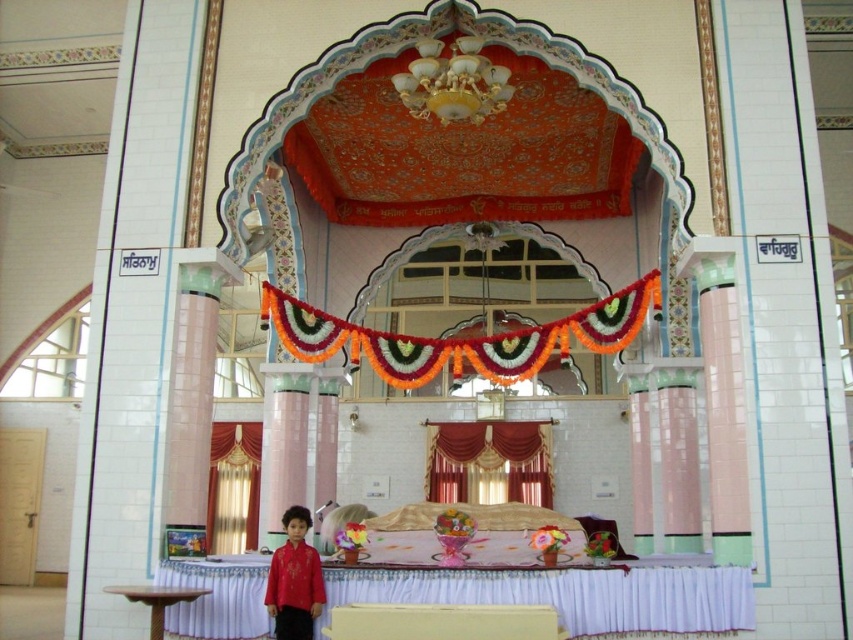
Question: Which of the following is the farthest from the observer?

Choices:
 (A) (497, 422)
 (B) (318, 605)
 (C) (253, 531)

Answer: (C)

Question: Observing the image, what is the correct spatial positioning of velvet red curtain at center in reference to gold velvet curtain at lower center?

Choices:
 (A) below
 (B) above

Answer: (B)

Question: Which of the following is the closest to the observer?

Choices:
 (A) gold velvet curtain at lower center
 (B) matte red shirt at lower center
 (C) velvet red curtain at center

Answer: (B)

Question: Estimate the real-world distances between objects in this image. Which object is farther from the matte red shirt at lower center?

Choices:
 (A) velvet red curtain at center
 (B) gold velvet curtain at lower center

Answer: (B)

Question: Observing the image, what is the correct spatial positioning of velvet red curtain at center in reference to matte red shirt at lower center?

Choices:
 (A) below
 (B) above

Answer: (A)

Question: Can you confirm if gold velvet curtain at lower center is positioned to the right of matte red shirt at lower center?

Choices:
 (A) no
 (B) yes

Answer: (A)